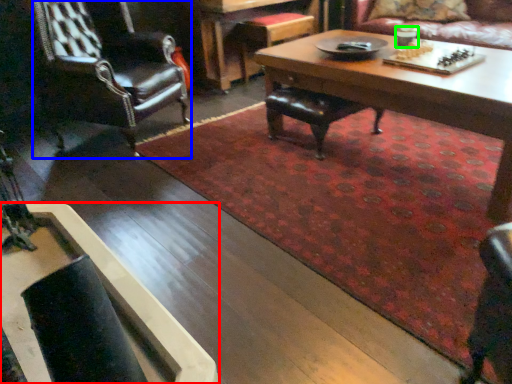
Question: Based on their relative distances, which object is farther from coffee table (highlighted by a red box)? Choose from chair (highlighted by a blue box) and coffee cup (highlighted by a green box).

Choices:
 (A) chair
 (B) coffee cup

Answer: (B)